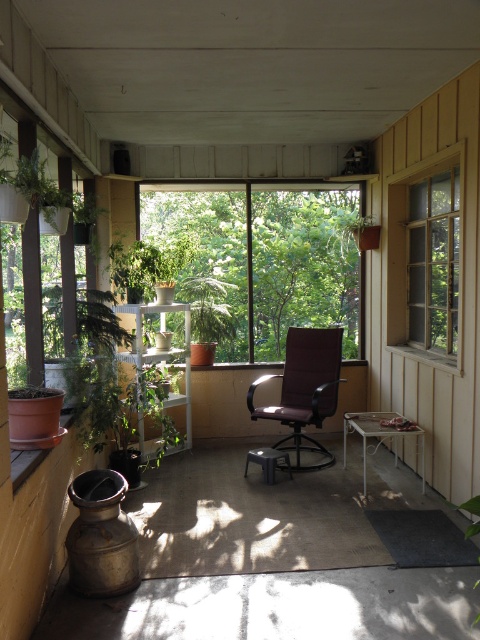
Question: Is transparent glass window at center below purple fabric chair at center?

Choices:
 (A) yes
 (B) no

Answer: (B)

Question: Among these objects, which one is nearest to the camera?

Choices:
 (A) clear glass window at upper right
 (B) purple fabric chair at center

Answer: (A)

Question: Observing the image, what is the correct spatial positioning of transparent glass window at center in reference to purple fabric chair at center?

Choices:
 (A) right
 (B) left

Answer: (B)

Question: Is transparent glass window at center to the left of clear glass window at upper right from the viewer's perspective?

Choices:
 (A) yes
 (B) no

Answer: (A)

Question: Estimate the real-world distances between objects in this image. Which object is farther from the green matte plant at left?

Choices:
 (A) clear glass window at upper right
 (B) transparent glass window at center
 (C) purple fabric chair at center

Answer: (A)

Question: Which object appears farthest from the camera in this image?

Choices:
 (A) purple fabric chair at center
 (B) green matte plant at left
 (C) clear glass window at upper right

Answer: (A)